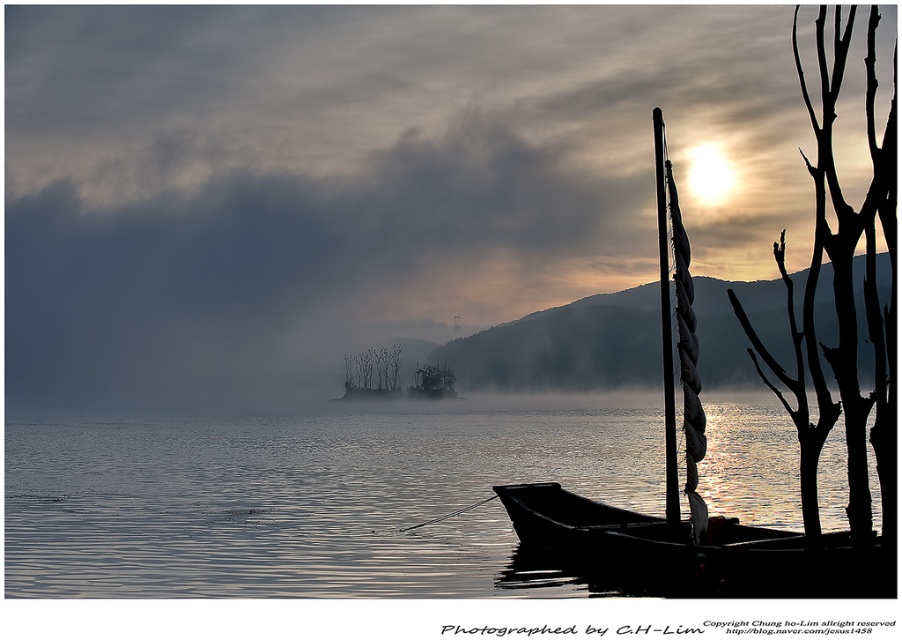
You are standing at the point closest to the boat in the image. There are two points marked in the scene, one at coordinates point [126,237] and another at point [827,541]. Which point is farther away from you?

Point [126,237] is behind point [827,541], so the point farther away from you is point [126,237].

You are an observer standing on the shore of the lake. You see the silvery sailboat at right and the black wood canoe at lower right. Which one has a wider physical structure?

The silvery sailboat at right has a wider physical structure than the black wood canoe at lower right because the silvery sailboat at right is wider according to the description.

In the scene shown: You are an observer standing on the shore looking at the silvery sailboat at right and the silhouette bark tree at right. Which object is closer to you?

The silvery sailboat at right is closer to you because it is positioned under the silhouette bark tree at right, meaning the tree is behind it.